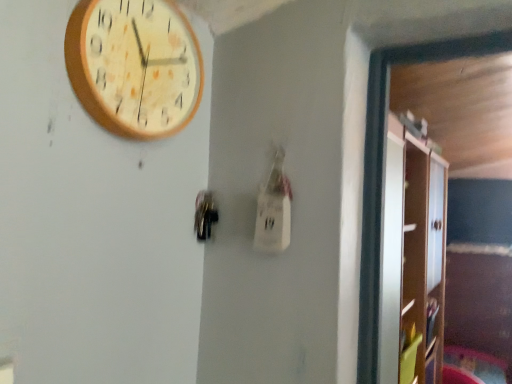
The image size is (512, 384). What do you see at coordinates (134, 66) in the screenshot?
I see `wooden clock at upper left` at bounding box center [134, 66].

You are a GUI agent. You are given a task and a screenshot of the screen. Output one action in this format:
    pyautogui.click(x=<x>, y=<y>)
    Task: Click on the wooden clock at upper left
    
    Given the screenshot: What is the action you would take?
    click(x=134, y=66)

Is there a large distance between wooden clock at upper left and metallic dark gray door handle at center?

No, wooden clock at upper left is not far away from metallic dark gray door handle at center.

Is wooden clock at upper left thinner than metallic dark gray door handle at center?

No, wooden clock at upper left is not thinner than metallic dark gray door handle at center.

From the image's perspective, is wooden clock at upper left beneath metallic dark gray door handle at center?

No, from the image's perspective, wooden clock at upper left is not beneath metallic dark gray door handle at center.

How many degrees apart are the facing directions of wooden clock at upper left and metallic dark gray door handle at center?

There is a 3.95-degree angle between the facing directions of wooden clock at upper left and metallic dark gray door handle at center.

From the image's perspective, which is below, wooden clock at upper left or white glossy cabinet at right?

white glossy cabinet at right.

Is wooden clock at upper left closer to camera compared to white glossy cabinet at right?

Yes, wooden clock at upper left is in front of white glossy cabinet at right.

Considering the sizes of objects wooden clock at upper left and white glossy cabinet at right in the image provided, who is wider, wooden clock at upper left or white glossy cabinet at right?

white glossy cabinet at right is wider.

Is wooden clock at upper left at the left side of white glossy cabinet at right?

Yes.

The width and height of the screenshot is (512, 384). What are the coordinates of `dresser below the metallic dark gray door handle at center (from the image's perspective)` in the screenshot? It's located at (412, 258).

Is the surface of metallic dark gray door handle at center in direct contact with white glossy cabinet at right?

No, metallic dark gray door handle at center is not beside white glossy cabinet at right.

Does metallic dark gray door handle at center have a lesser height compared to white glossy cabinet at right?

Yes, metallic dark gray door handle at center is shorter than white glossy cabinet at right.

Would you say white glossy cabinet at right is a long distance from wooden clock at upper left?

Yes, white glossy cabinet at right and wooden clock at upper left are located far from each other.

From a real-world perspective, is white glossy cabinet at right located higher than wooden clock at upper left?

No, from a real-world perspective, white glossy cabinet at right is not on top of wooden clock at upper left.

Does point (402, 200) come behind point (122, 75)?

Yes, point (402, 200) is farther from viewer.

Consider the image. Is white glossy cabinet at right completely or partially outside of wooden clock at upper left?

Absolutely, white glossy cabinet at right is external to wooden clock at upper left.

Is white glossy cabinet at right looking in the opposite direction of metallic dark gray door handle at center?

No, metallic dark gray door handle at center is not at the back of white glossy cabinet at right.

Is white glossy cabinet at right bigger than metallic dark gray door handle at center?

Yes, white glossy cabinet at right is bigger than metallic dark gray door handle at center.

Measure the distance between white glossy cabinet at right and metallic dark gray door handle at center.

They are 4.53 feet apart.

From the picture: Is white glossy cabinet at right at the left side of metallic dark gray door handle at center?

No, white glossy cabinet at right is not to the left of metallic dark gray door handle at center.

Considering the positions of objects metallic dark gray door handle at center and wooden clock at upper left in the image provided, who is more to the right, metallic dark gray door handle at center or wooden clock at upper left?

metallic dark gray door handle at center is more to the right.

Does metallic dark gray door handle at center have a lesser width compared to wooden clock at upper left?

Yes.

I want to click on wall clock on the left of metallic dark gray door handle at center, so click(x=134, y=66).

Find the location of a particular element. dresser below the wooden clock at upper left (from a real-world perspective) is located at coordinates (412, 258).

Estimate the real-world distances between objects in this image. Which object is closer to white glossy cabinet at right, wooden clock at upper left or metallic dark gray door handle at center?

wooden clock at upper left.

Based on their spatial positions, is white glossy cabinet at right or wooden clock at upper left further from metallic dark gray door handle at center?

white glossy cabinet at right.

Which object lies nearer to the anchor point wooden clock at upper left, metallic dark gray door handle at center or white glossy cabinet at right?

metallic dark gray door handle at center lies closer to wooden clock at upper left than the other object.

Consider the image. From the image, which object appears to be farther from white glossy cabinet at right, metallic dark gray door handle at center or wooden clock at upper left?

metallic dark gray door handle at center is further to white glossy cabinet at right.

When comparing their distances from metallic dark gray door handle at center, does wooden clock at upper left or white glossy cabinet at right seem closer?

wooden clock at upper left lies closer to metallic dark gray door handle at center than the other object.

Which object lies nearer to the anchor point wooden clock at upper left, white glossy cabinet at right or metallic dark gray door handle at center?

metallic dark gray door handle at center is closer to wooden clock at upper left.

Find the location of a particular element. The height and width of the screenshot is (384, 512). door handle located between wooden clock at upper left and white glossy cabinet at right in the left-right direction is located at coordinates (205, 215).